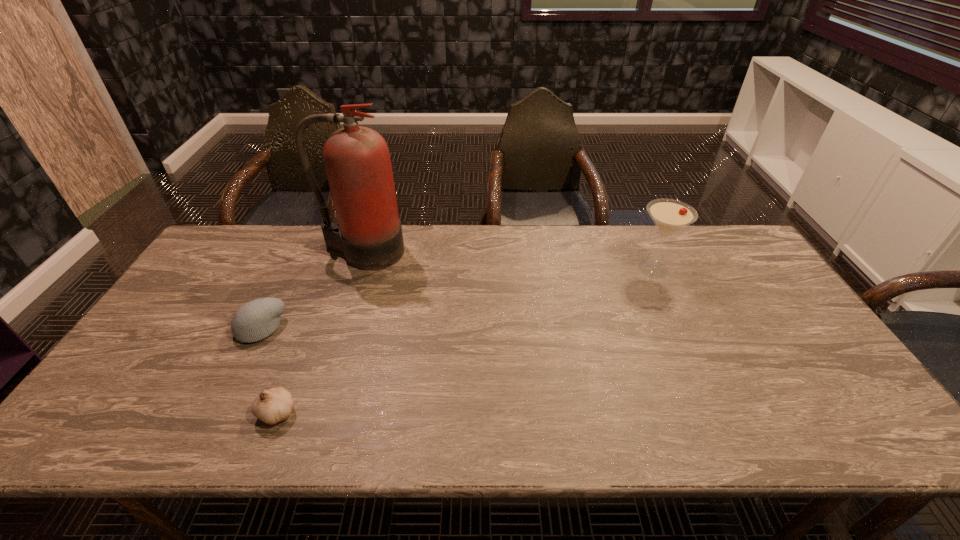
Where is `fire extinguisher`? This screenshot has width=960, height=540. fire extinguisher is located at coordinates (357, 161).

Locate an element on the screen. The image size is (960, 540). the rightmost object is located at coordinates (669, 215).

Locate an element on the screen. The height and width of the screenshot is (540, 960). the third shortest object is located at coordinates (669, 215).

In order to click on the second nearest object in this screenshot , I will do `click(256, 320)`.

The height and width of the screenshot is (540, 960). What are the coordinates of `the leftmost object` in the screenshot? It's located at click(x=256, y=320).

This screenshot has width=960, height=540. I want to click on garlic, so click(272, 406).

The image size is (960, 540). I want to click on vacant space positioned at the nozzle of the fire extinguisher, so click(328, 356).

You are a GUI agent. You are given a task and a screenshot of the screen. Output one action in this format:
    pyautogui.click(x=<x>, y=<y>)
    Task: Click on the free space located 0.130m on the right of the third shortest object
    The height and width of the screenshot is (540, 960).
    Given the screenshot: What is the action you would take?
    pyautogui.click(x=717, y=269)

Find the location of a particular element. The height and width of the screenshot is (540, 960). free space located on the back of the leftmost object is located at coordinates (283, 282).

The width and height of the screenshot is (960, 540). In order to click on vacant space located 0.280m on the left of the garlic in this screenshot , I will do `click(136, 411)`.